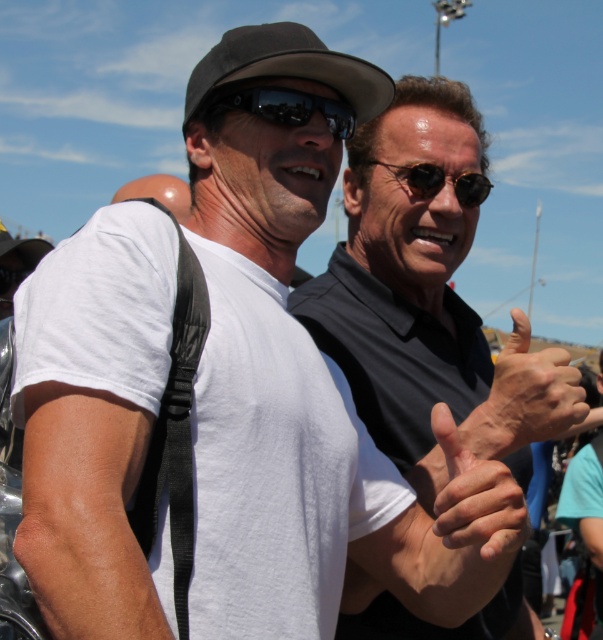
Question: Among these objects, which one is nearest to the camera?

Choices:
 (A) black reflective sunglasses at center
 (B) matte black hand at center
 (C) smooth skin hand at center

Answer: (C)

Question: Can you confirm if black matte shirt at center is positioned to the left of black fabric baseball hat at upper center?

Choices:
 (A) yes
 (B) no

Answer: (B)

Question: Among these objects, which one is nearest to the camera?

Choices:
 (A) smooth skin hand at center
 (B) dry skin hand at center

Answer: (B)

Question: Can you confirm if matte black hand at center is bigger than black reflective sunglasses at center?

Choices:
 (A) no
 (B) yes

Answer: (B)

Question: Which point is closer to the camera?

Choices:
 (A) (487, 529)
 (B) (522, 330)
 (C) (376, 356)
 (D) (268, 88)

Answer: (A)

Question: Can you confirm if smooth skin hand at center is wider than black reflective sunglasses at center?

Choices:
 (A) no
 (B) yes

Answer: (B)